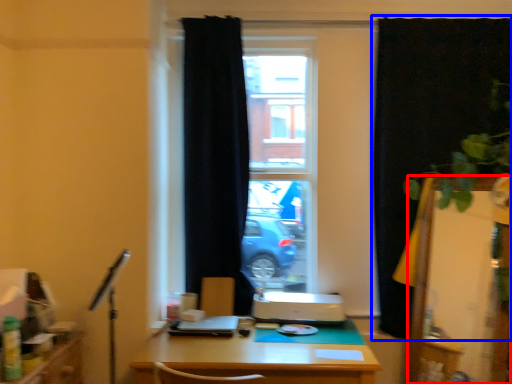
Question: Among these objects, which one is nearest to the camera, screen door (highlighted by a red box) or curtain (highlighted by a blue box)?

Choices:
 (A) screen door
 (B) curtain

Answer: (A)